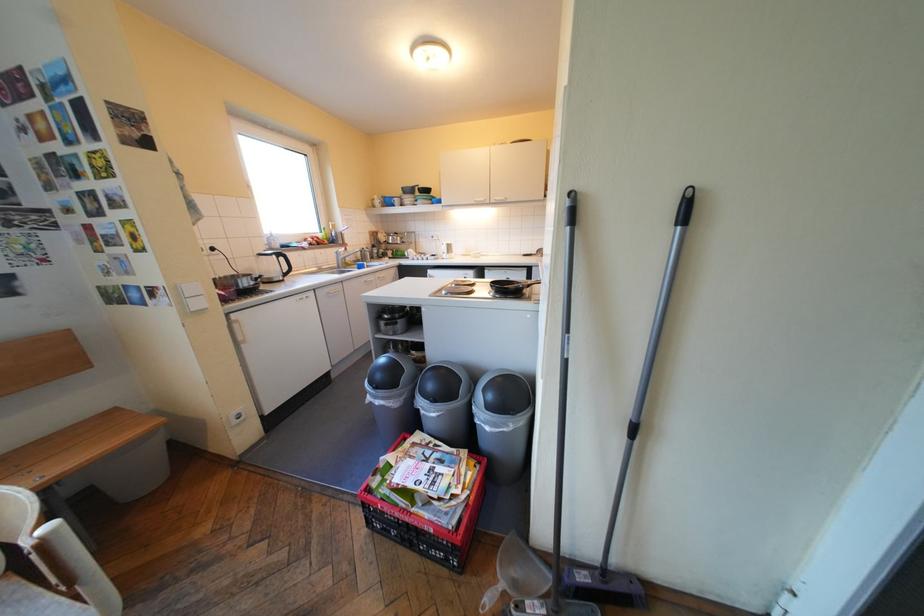
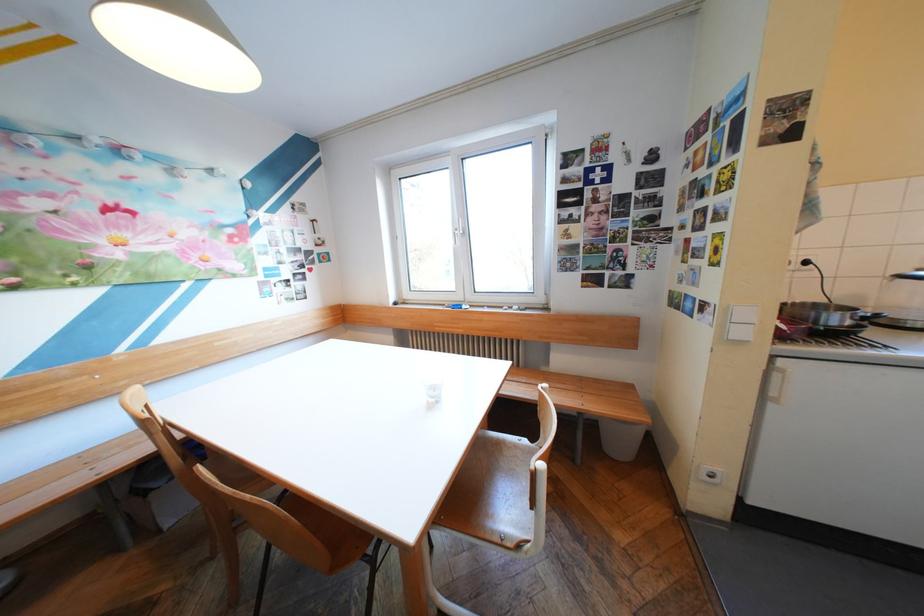
Find the pixel in the second image that matches [220,240] in the first image.

(816, 252)